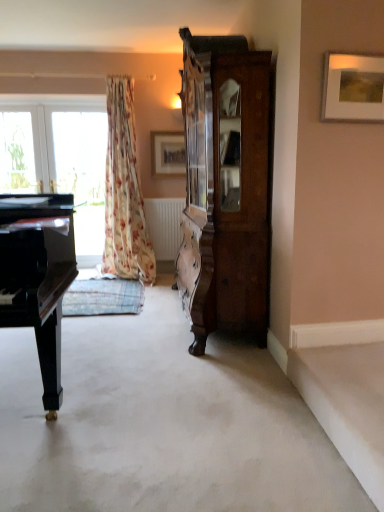
Question: Does wooden picture frame at center, the 2th picture frame positioned from the right, lie behind wooden picture frame at upper right, arranged as the 2th picture frame when viewed from the left?

Choices:
 (A) no
 (B) yes

Answer: (B)

Question: Can you confirm if wooden picture frame at center, acting as the 1th picture frame starting from the back, is positioned to the right of wooden picture frame at upper right, positioned as the first picture frame in front-to-back order?

Choices:
 (A) no
 (B) yes

Answer: (A)

Question: Considering the relative sizes of wooden picture frame at center, the first picture frame in the left-to-right sequence, and wooden picture frame at upper right, the 1th picture frame when ordered from right to left, in the image provided, is wooden picture frame at center, the first picture frame in the left-to-right sequence, smaller than wooden picture frame at upper right, the 1th picture frame when ordered from right to left,?

Choices:
 (A) no
 (B) yes

Answer: (A)

Question: Is wooden picture frame at center, the first picture frame in the left-to-right sequence, located outside wooden picture frame at upper right, positioned as the first picture frame in front-to-back order?

Choices:
 (A) yes
 (B) no

Answer: (A)

Question: From the image's perspective, is wooden picture frame at center, the first picture frame in the left-to-right sequence, beneath wooden picture frame at upper right, the 1th picture frame when ordered from right to left?

Choices:
 (A) no
 (B) yes

Answer: (A)

Question: From their relative heights in the image, would you say white carpet at center is taller or shorter than dark wood cabinet at right?

Choices:
 (A) short
 (B) tall

Answer: (A)

Question: From a real-world perspective, is white carpet at center above or below dark wood cabinet at right?

Choices:
 (A) above
 (B) below

Answer: (B)

Question: Would you say white carpet at center is inside or outside dark wood cabinet at right?

Choices:
 (A) outside
 (B) inside

Answer: (A)

Question: Is white carpet at center to the left or to the right of dark wood cabinet at right in the image?

Choices:
 (A) left
 (B) right

Answer: (A)

Question: Is dark wood cabinet at right wider or thinner than floral fabric curtain at left?

Choices:
 (A) thin
 (B) wide

Answer: (A)

Question: Considering their positions, is dark wood cabinet at right located in front of or behind floral fabric curtain at left?

Choices:
 (A) front
 (B) behind

Answer: (A)

Question: Considering the positions of dark wood cabinet at right and floral fabric curtain at left in the image, is dark wood cabinet at right taller or shorter than floral fabric curtain at left?

Choices:
 (A) tall
 (B) short

Answer: (A)

Question: Would you say dark wood cabinet at right is to the left or to the right of floral fabric curtain at left in the picture?

Choices:
 (A) right
 (B) left

Answer: (A)

Question: In the image, is transparent glass window at left positioned in front of or behind white carpet at center?

Choices:
 (A) behind
 (B) front

Answer: (A)

Question: Is transparent glass window at left wider or thinner than white carpet at center?

Choices:
 (A) thin
 (B) wide

Answer: (A)